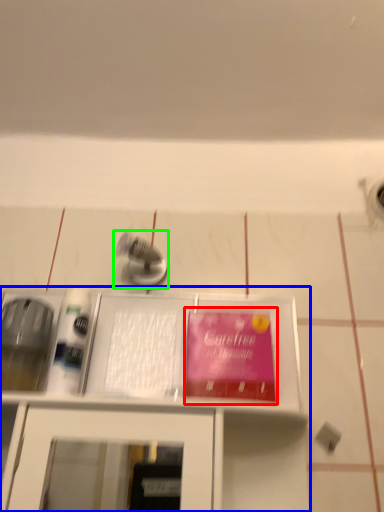
Question: Based on their relative distances, which object is nearer to paperback book (highlighted by a red box)? Choose from furniture (highlighted by a blue box) and tap (highlighted by a green box).

Choices:
 (A) furniture
 (B) tap

Answer: (A)